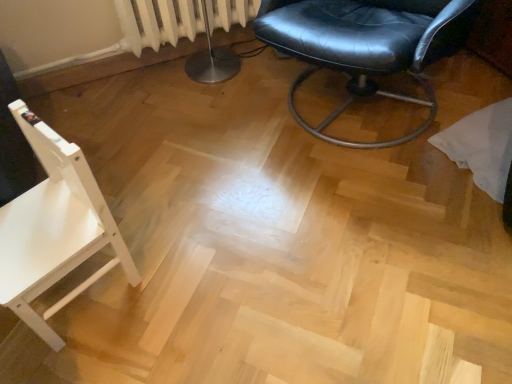
Locate an element on the screen. This screenshot has height=384, width=512. vacant area to the right of white wood chair at left, positioned as the 2th chair in right-to-left order is located at coordinates (167, 283).